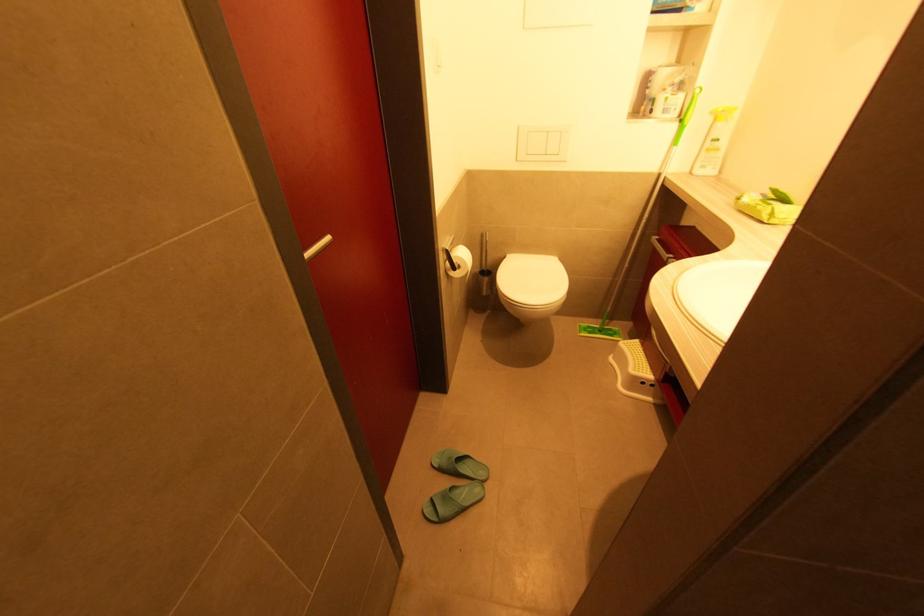
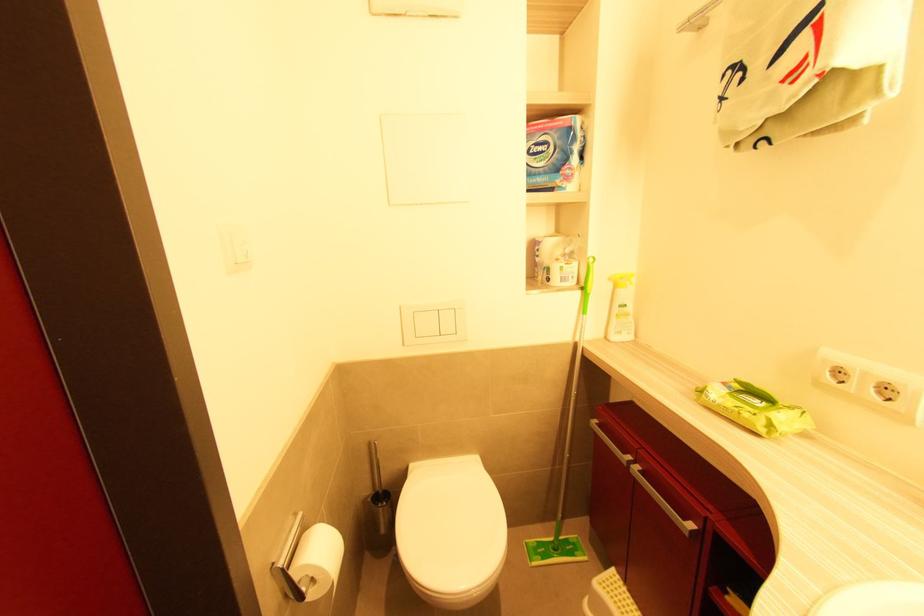
How did the camera likely rotate?

The rotation direction of the camera is right-up.